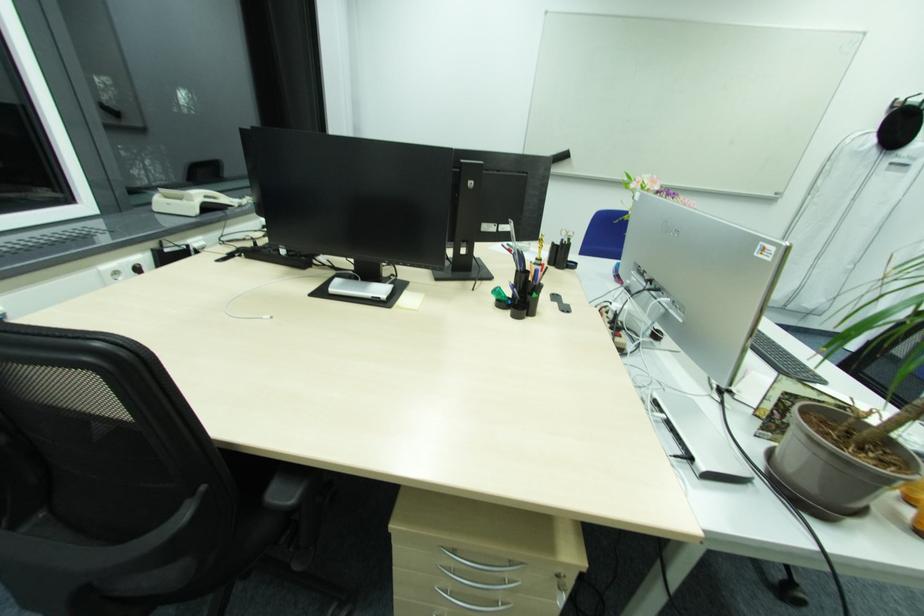
Image resolution: width=924 pixels, height=616 pixels. I want to click on black chair sitting surface, so click(x=244, y=483).